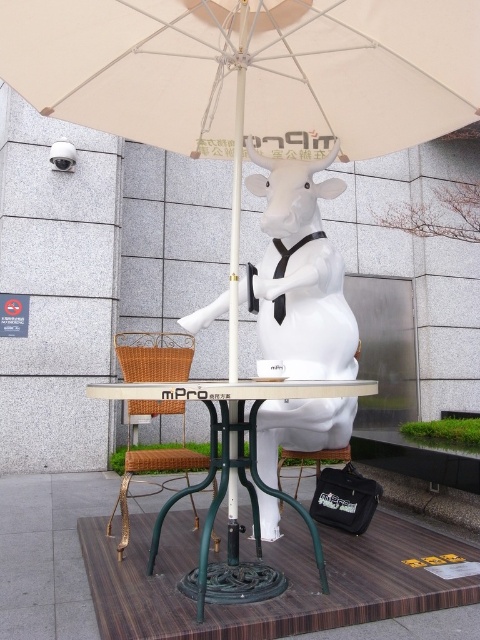
Question: Which point is closer to the camera taking this photo?

Choices:
 (A) (268, 440)
 (B) (354, 388)
 (C) (159, 460)

Answer: (B)

Question: Is white glossy statue at center bigger than woven rattan stool at lower center?

Choices:
 (A) yes
 (B) no

Answer: (A)

Question: Estimate the real-world distances between objects in this image. Which object is closer to the woven rattan stool at lower center?

Choices:
 (A) white glossy statue at center
 (B) green metal table at center

Answer: (B)

Question: Among these objects, which one is nearest to the camera?

Choices:
 (A) woven rattan stool at lower center
 (B) green metal table at center

Answer: (B)

Question: Does white glossy statue at center come in front of green metal table at center?

Choices:
 (A) yes
 (B) no

Answer: (B)

Question: Does white glossy statue at center appear under green metal table at center?

Choices:
 (A) no
 (B) yes

Answer: (A)